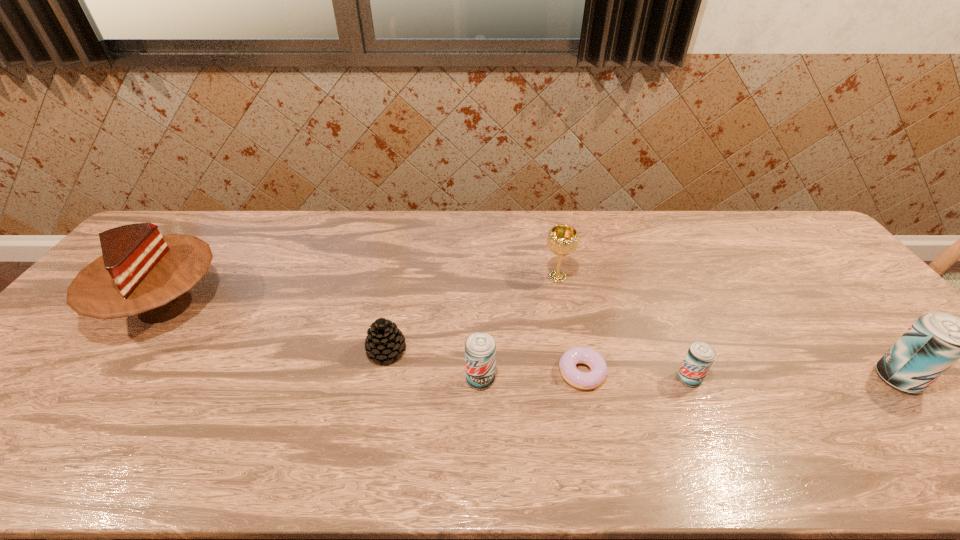
Find the location of `free space located 0.170m on the right of the fifth object from right to left`. free space located 0.170m on the right of the fifth object from right to left is located at coordinates (565, 379).

This screenshot has width=960, height=540. Find the location of `vacant space positioned 0.210m on the back of the shortest beer can`. vacant space positioned 0.210m on the back of the shortest beer can is located at coordinates (x=660, y=308).

This screenshot has height=540, width=960. Find the location of `vacant point located 0.290m on the left of the rightmost beer can`. vacant point located 0.290m on the left of the rightmost beer can is located at coordinates (757, 379).

Identify the location of vacant space positioned 0.080m on the back of the chalice. This screenshot has width=960, height=540. (552, 251).

At what (x,y) coordinates should I click in order to perform the action: click on blank area located 0.140m on the back of the cake. Please return your answer as a coordinate pair (x, y). Looking at the image, I should click on (214, 240).

This screenshot has height=540, width=960. I want to click on free space located at the narrow end of the sixth object from right to left, so click(x=528, y=351).

Locate an element on the screen. This screenshot has height=540, width=960. vacant region located on the back of the doughnut is located at coordinates click(558, 257).

At what (x,y) coordinates should I click in order to perform the action: click on doughnut located in the near edge section of the desktop. Please return your answer as a coordinate pair (x, y). The image size is (960, 540). Looking at the image, I should click on (589, 380).

The width and height of the screenshot is (960, 540). I want to click on object that is positioned at the left edge, so click(140, 272).

I want to click on object situated at the right edge, so click(936, 340).